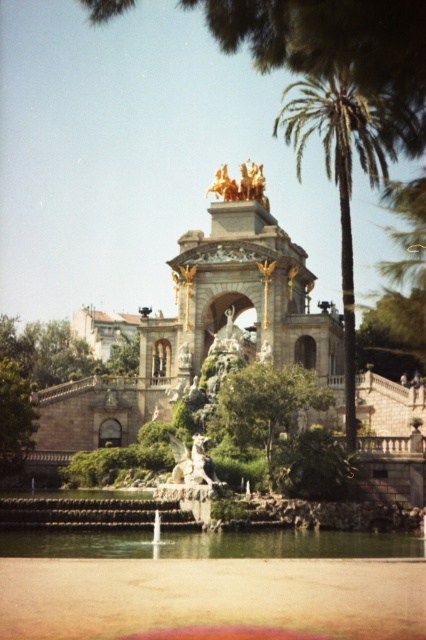
Is point (150, 548) behind point (0, 428)?

No, it is not.

Image resolution: width=426 pixels, height=640 pixels. Find the location of `clear water at center`. clear water at center is located at coordinates (290, 544).

The image size is (426, 640). I want to click on clear water at center, so click(290, 544).

Does green leafy tree at center have a lesser width compared to green leafy tree at left?

In fact, green leafy tree at center might be wider than green leafy tree at left.

Between green leafy tree at center and green leafy tree at left, which one appears on the right side from the viewer's perspective?

green leafy tree at center

Where is `green leafy tree at center`? The height and width of the screenshot is (640, 426). green leafy tree at center is located at coordinates (267, 401).

Is clear water at center taller than green leafy tree at center?

In fact, clear water at center may be shorter than green leafy tree at center.

Is point (293, 541) positioned before point (273, 419)?

Yes, it is in front of point (273, 419).

Identify the location of clear water at center. (290, 544).